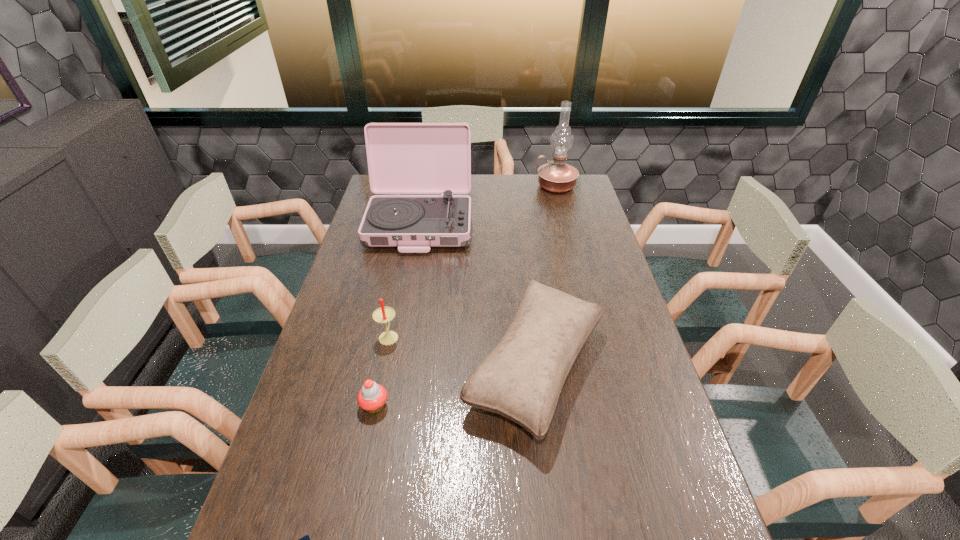
The width and height of the screenshot is (960, 540). In the image, there is a desktop. In order to click on vacant space at the right edge in this screenshot , I will do `click(598, 335)`.

This screenshot has height=540, width=960. I want to click on vacant space that is in between the second farthest object and the candle, so click(x=404, y=280).

This screenshot has width=960, height=540. What are the coordinates of `free space between the cushion and the second farthest object` in the screenshot? It's located at (478, 295).

The image size is (960, 540). What are the coordinates of `free spot between the farthest object and the cushion` in the screenshot? It's located at (545, 276).

The height and width of the screenshot is (540, 960). In order to click on vacant space that is in between the cushion and the candle in this screenshot , I will do `click(462, 351)`.

Image resolution: width=960 pixels, height=540 pixels. What are the coordinates of `free space that is in between the record player and the cushion` in the screenshot? It's located at (478, 295).

The image size is (960, 540). In order to click on vacant area between the farthest object and the candle in this screenshot , I will do `click(472, 261)`.

This screenshot has height=540, width=960. In order to click on object identified as the fourth closest to the cupcake in this screenshot , I will do `click(403, 158)`.

Where is `object that stands as the third closest to the cupcake`? This screenshot has height=540, width=960. object that stands as the third closest to the cupcake is located at coordinates (306, 539).

Locate an element on the screen. free space that satisfies the following two spatial constraints: 1. on the back side of the cushion; 2. on the left side of the farthest object is located at coordinates (515, 186).